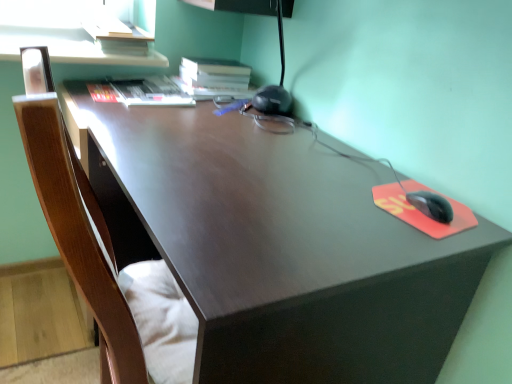
Find the location of a particular element. free space in front of hardcover book at upper left, the first book viewed from the left is located at coordinates (128, 116).